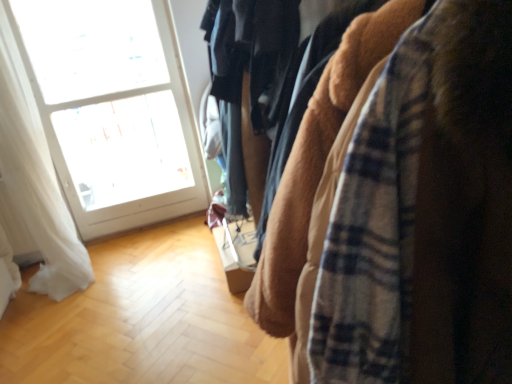
At what (x,y) coordinates should I click in order to perform the action: click on plaid flannel shirt at right. Please return your answer as a coordinate pair (x, y). Looking at the image, I should click on (425, 214).

From their relative heights in the image, would you say white sheer curtain at left is taller or shorter than plaid flannel shirt at right?

In the image, white sheer curtain at left appears to be taller than plaid flannel shirt at right.

Based on the photo, is white sheer curtain at left turned away from plaid flannel shirt at right?

No, white sheer curtain at left's orientation is not away from plaid flannel shirt at right.

In terms of size, does white sheer curtain at left appear bigger or smaller than plaid flannel shirt at right?

In the image, white sheer curtain at left appears to be smaller than plaid flannel shirt at right.

From the image's perspective, is white sheer curtain at left located above or below plaid flannel shirt at right?

white sheer curtain at left is situated higher than plaid flannel shirt at right in the image.

From the image's perspective, does plaid flannel shirt at right appear higher than white sheer curtain at left?

No, from the image's perspective, plaid flannel shirt at right is not on top of white sheer curtain at left.

From a real-world perspective, between plaid flannel shirt at right and white sheer curtain at left, who is vertically higher?

From a 3D spatial view, white sheer curtain at left is above.

Between plaid flannel shirt at right and white sheer curtain at left, which one has larger width?

plaid flannel shirt at right.

From the image's perspective, which is below, white glass window at upper left or plaid flannel shirt at right?

plaid flannel shirt at right.

From the picture: Does white glass window at upper left come in front of plaid flannel shirt at right?

No, it is not.

Is the surface of white glass window at upper left in direct contact with plaid flannel shirt at right?

No, white glass window at upper left is not beside plaid flannel shirt at right.

Looking at their sizes, would you say white glass window at upper left is wider or thinner than plaid flannel shirt at right?

Considering their sizes, white glass window at upper left looks slimmer than plaid flannel shirt at right.

Considering the positions of objects white sheer curtain at left and white glass window at upper left in the image provided, who is behind, white sheer curtain at left or white glass window at upper left?

white glass window at upper left is behind.

From the image's perspective, which one is positioned lower, white sheer curtain at left or white glass window at upper left?

white sheer curtain at left, from the image's perspective.

The height and width of the screenshot is (384, 512). I want to click on curtain beneath the white glass window at upper left (from a real-world perspective), so click(x=36, y=179).

Can you tell me how much white sheer curtain at left and white glass window at upper left differ in facing direction?

The angle between the facing direction of white sheer curtain at left and the facing direction of white glass window at upper left is 0.477 degrees.

Can you confirm if plaid flannel shirt at right is shorter than white glass window at upper left?

Yes.

Would you say plaid flannel shirt at right contains white glass window at upper left?

No, white glass window at upper left is not a part of plaid flannel shirt at right.

From the image's perspective, is plaid flannel shirt at right below white glass window at upper left?

Yes, from the image's perspective, plaid flannel shirt at right is below white glass window at upper left.

How many degrees apart are the facing directions of plaid flannel shirt at right and white glass window at upper left?

The angle between the facing direction of plaid flannel shirt at right and the facing direction of white glass window at upper left is 91.1 degrees.

Locate an element on the screen. This screenshot has width=512, height=384. curtain on the left side of white glass window at upper left is located at coordinates (36, 179).

Is point (89, 59) closer or farther from the camera than point (31, 131)?

Point (89, 59).

Considering the sizes of objects white glass window at upper left and white sheer curtain at left in the image provided, who is taller, white glass window at upper left or white sheer curtain at left?

Standing taller between the two is white glass window at upper left.

How many degrees apart are the facing directions of white glass window at upper left and white sheer curtain at left?

0.477 degrees separate the facing orientations of white glass window at upper left and white sheer curtain at left.

This screenshot has width=512, height=384. I want to click on curtain lying on the left of plaid flannel shirt at right, so click(36, 179).

The image size is (512, 384). In order to click on curtain located above the plaid flannel shirt at right (from the image's perspective) in this screenshot , I will do `click(36, 179)`.

Estimate the real-world distances between objects in this image. Which object is closer to white sheer curtain at left, white glass window at upper left or plaid flannel shirt at right?

white glass window at upper left lies closer to white sheer curtain at left than the other object.

Looking at the image, which one is located further to plaid flannel shirt at right, white glass window at upper left or white sheer curtain at left?

white glass window at upper left.

Looking at this image, from the image, which object appears to be nearer to white glass window at upper left, plaid flannel shirt at right or white sheer curtain at left?

white sheer curtain at left is closer to white glass window at upper left.

Which object lies nearer to the anchor point white glass window at upper left, white sheer curtain at left or plaid flannel shirt at right?

Based on the image, white sheer curtain at left appears to be nearer to white glass window at upper left.

Estimate the real-world distances between objects in this image. Which object is further from white sheer curtain at left, plaid flannel shirt at right or white glass window at upper left?

The object further to white sheer curtain at left is plaid flannel shirt at right.

Estimate the real-world distances between objects in this image. Which object is further from plaid flannel shirt at right, white sheer curtain at left or white glass window at upper left?

Based on the image, white glass window at upper left appears to be further to plaid flannel shirt at right.

In order to click on curtain between plaid flannel shirt at right and white glass window at upper left from front to back in this screenshot , I will do `click(36, 179)`.